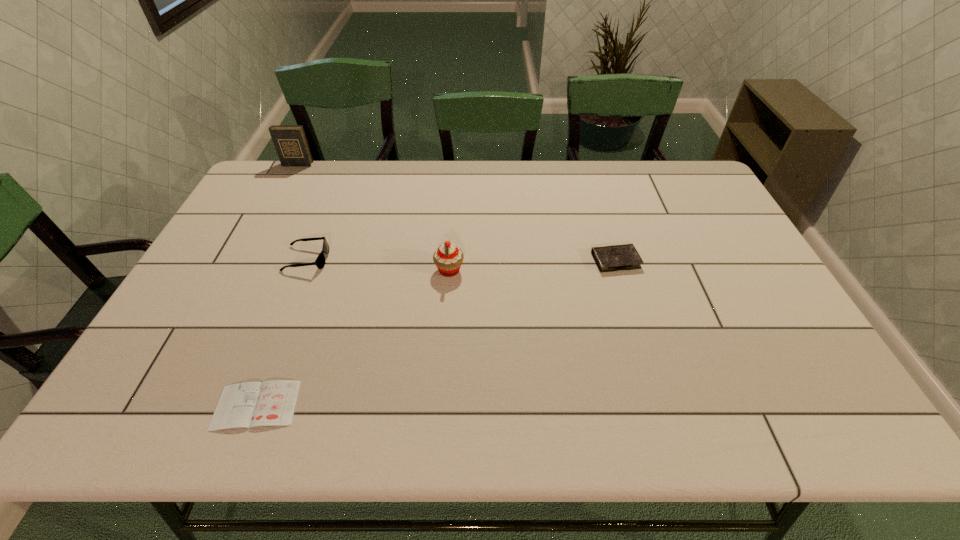
In the image, there is a desktop. Identify the location of vacant space at the left edge. The image size is (960, 540). (268, 200).

In the image, there is a desktop. Where is `vacant area at the right edge`? The width and height of the screenshot is (960, 540). vacant area at the right edge is located at coordinates (787, 327).

You are a GUI agent. You are given a task and a screenshot of the screen. Output one action in this format:
    pyautogui.click(x=<x>, y=<y>)
    Task: Click on the vacant space at the far left corner of the desktop
    
    Given the screenshot: What is the action you would take?
    pyautogui.click(x=262, y=179)

In the image, there is a desktop. At what (x,y) coordinates should I click in order to perform the action: click on blank space at the near left corner. Please return your answer as a coordinate pair (x, y). The width and height of the screenshot is (960, 540). Looking at the image, I should click on point(134,399).

The height and width of the screenshot is (540, 960). In order to click on free space at the far right corner in this screenshot , I will do [x=684, y=187].

Where is `vacant space that's between the tallest diary and the second shortest diary`? vacant space that's between the tallest diary and the second shortest diary is located at coordinates (456, 212).

I want to click on unoccupied position between the sunglasses and the fourth shortest object, so click(378, 265).

This screenshot has width=960, height=540. I want to click on free space between the tallest diary and the nearest object, so click(276, 285).

In order to click on unoccupied area between the nearest object and the cupcake in this screenshot , I will do `click(353, 338)`.

Image resolution: width=960 pixels, height=540 pixels. In order to click on vacant space in between the second object from right to left and the farthest diary in this screenshot , I will do `click(373, 217)`.